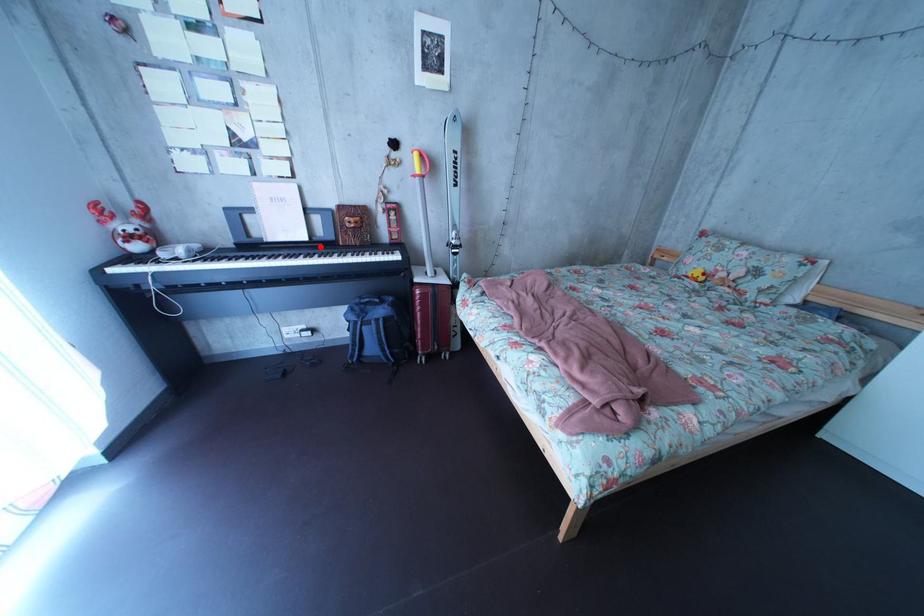
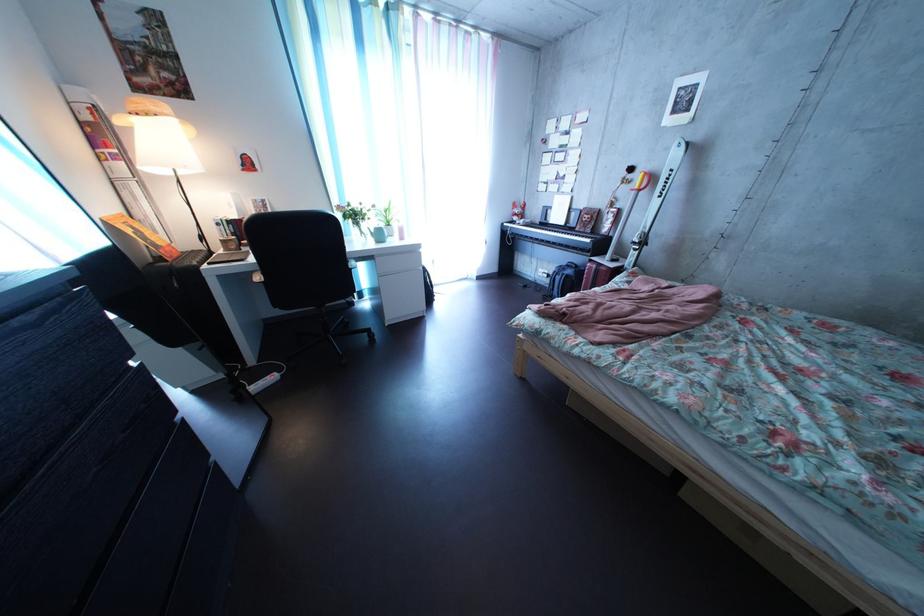
Question: A red point is marked in image1. In image2, is the corresponding 3D point closer to the camera or farther? Reply with the corresponding letter.

Choices:
 (A) The corresponding 3D point is closer.
 (B) The corresponding 3D point is farther.

Answer: (A)